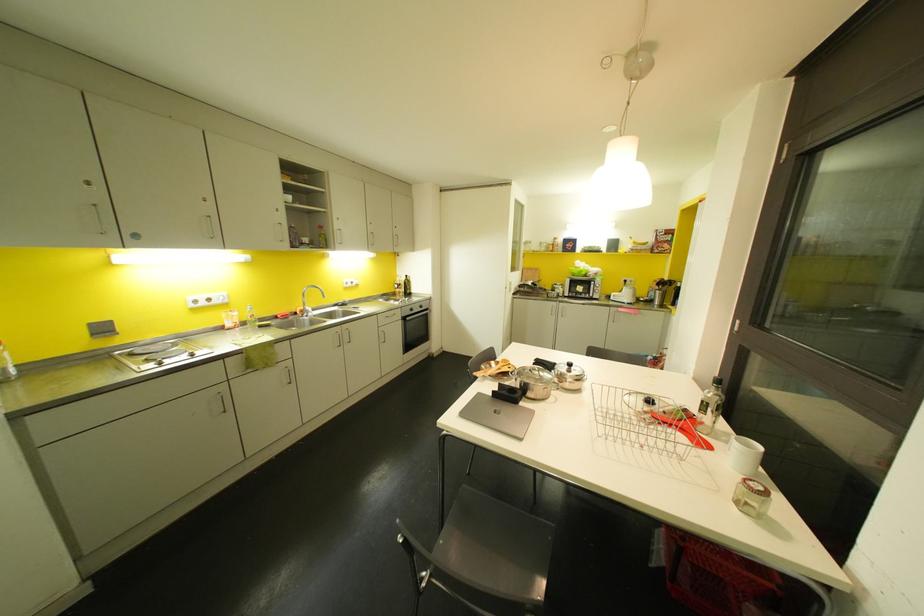
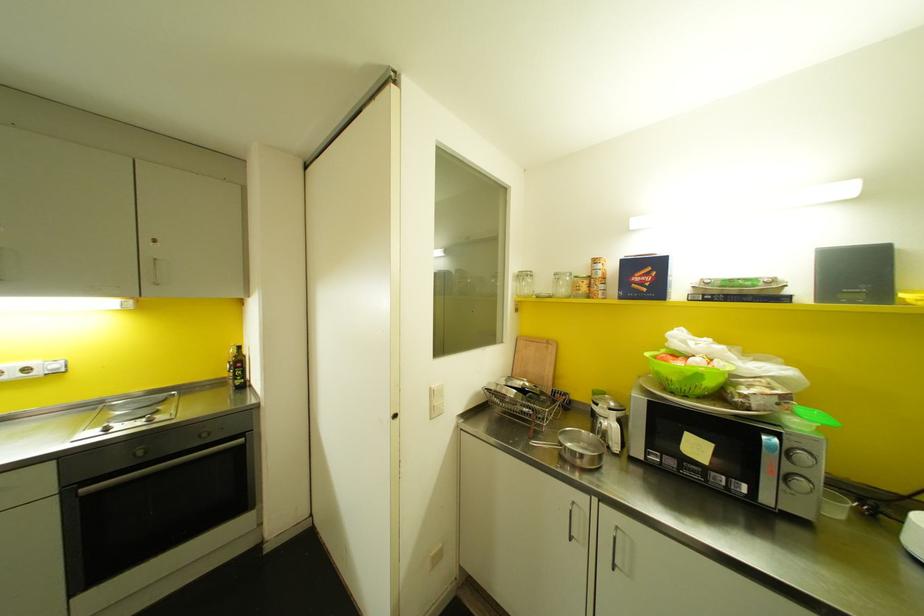
Where in the second image is the point corresponding to the point at 574,240 from the first image?

(659, 264)